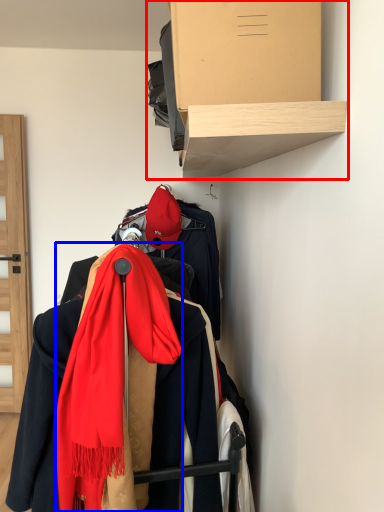
Question: Which of the following is the farthest to the observer, shelf (highlighted by a red box) or scarf (highlighted by a blue box)?

Choices:
 (A) shelf
 (B) scarf

Answer: (B)